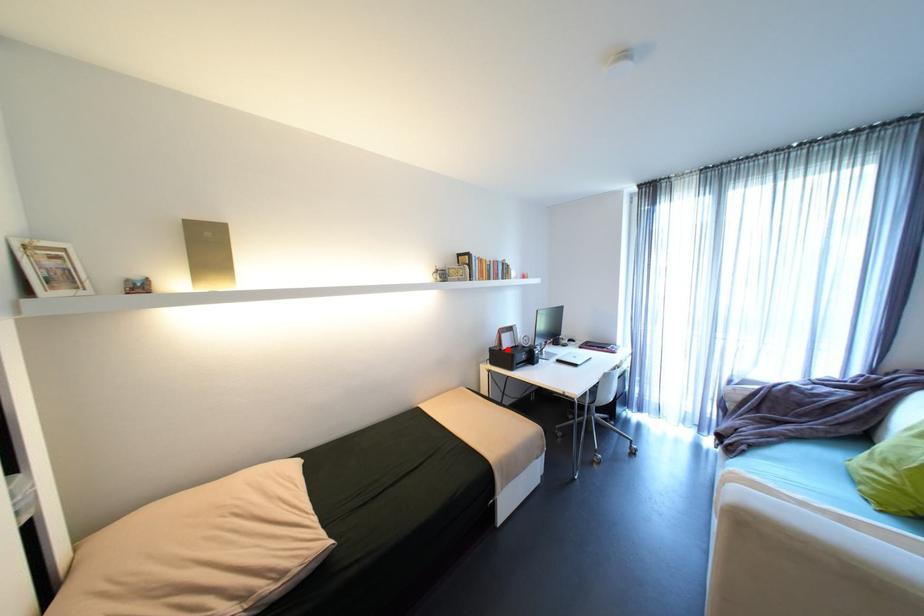
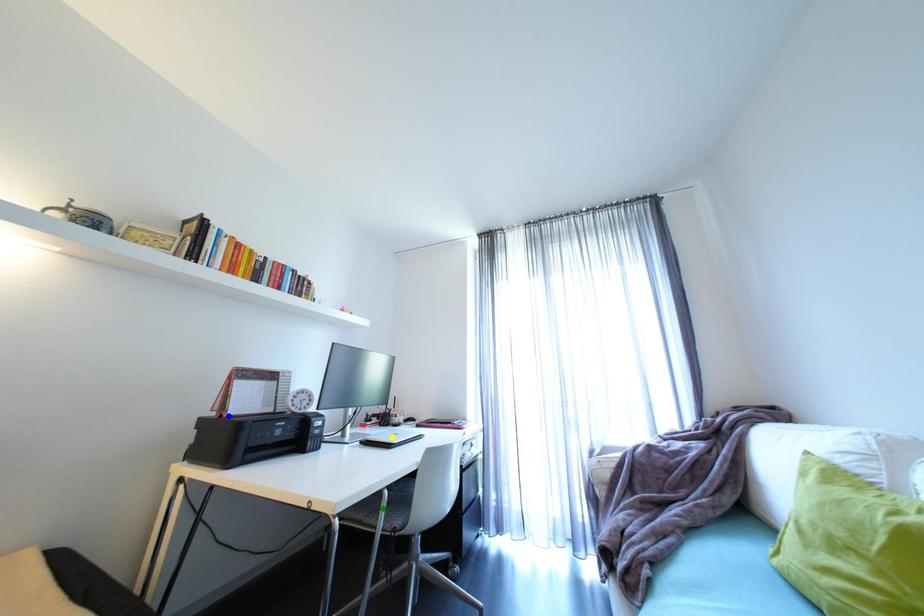
Question: I am providing you with two images of the same scene from different viewpoints. A red point is marked on the first image. You are given multiple points on the second image. Can you choose the point in image 2 that corresponds to the point in image 1?

Choices:
 (A) green point
 (B) yellow point
 (C) blue point

Answer: (C)